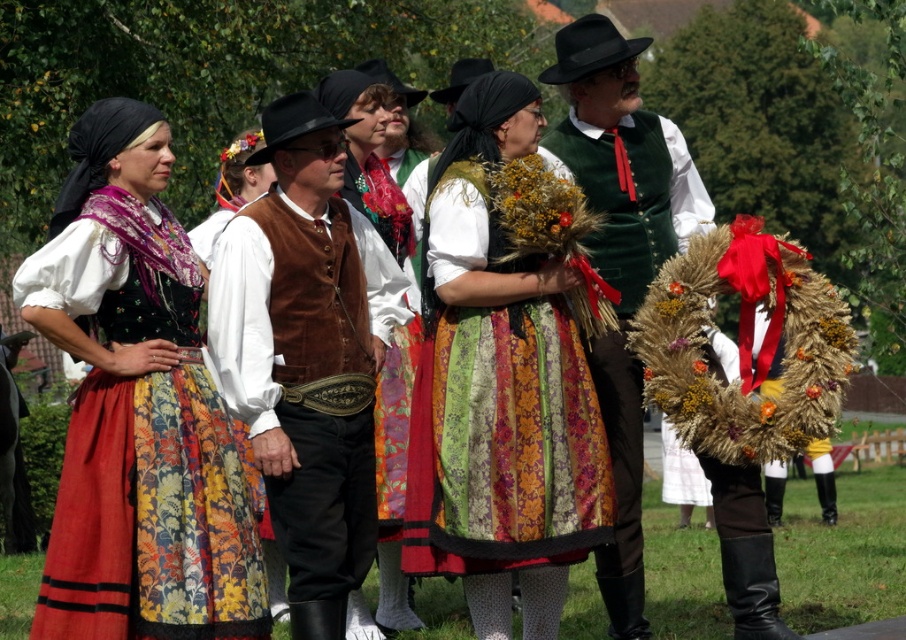
You are a photographer taking pictures of the cultural event. You notice the matte floral skirt at center and the brown suede vest at center. Which one is positioned higher on the person wearing them?

The matte floral skirt at center is located above the brown suede vest at center, so it is positioned higher on the person wearing them.

Consider the image. In the scene of the cultural festival, there are two central items worn by participants. You need to determine their positions relative to each other. Which object is positioned to the left when observing the matte floral skirt at center and the brown suede vest at center?

The matte floral skirt at center is to the left of brown suede vest at center according to the description.

You are a photographer standing at the edge of the grassy area. You want to take a photo of the matte floral skirt at center and the green velvet vest at center so that both are clearly visible in the frame. Given that your camera has a maximum focus range of 5 meters, will you be able to capture both objects in focus without moving closer?

The matte floral skirt at center and green velvet vest at center are 6.08 meters apart from each other. Since the distance between them exceeds the camera maximum focus range of 5 meters, you will not be able to capture both objects in focus without moving closer.